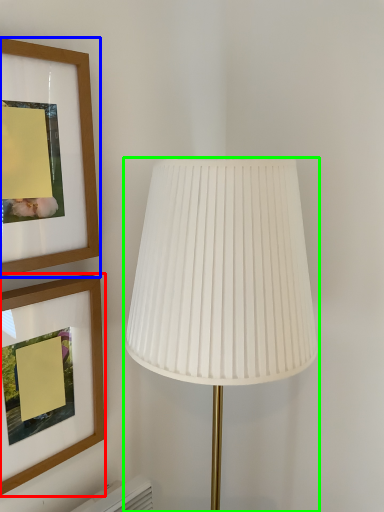
Question: Which object is positioned farthest from picture frame (highlighted by a red box)? Select from picture frame (highlighted by a blue box) and lamp (highlighted by a green box).

Choices:
 (A) picture frame
 (B) lamp

Answer: (B)